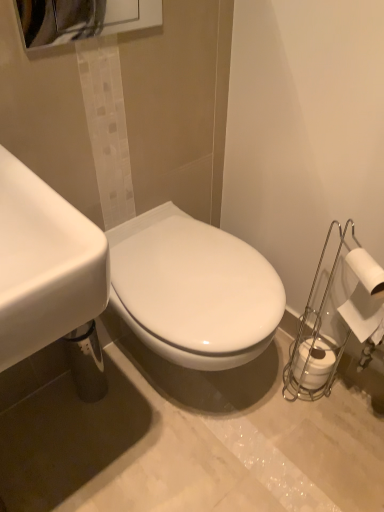
Question: Considering the relative positions of white matte toilet paper at lower right, placed as the 1th toilet paper when sorted from bottom to top, and white matte toilet paper at right, the 1th toilet paper positioned from the top, in the image provided, is white matte toilet paper at lower right, placed as the 1th toilet paper when sorted from bottom to top, to the right of white matte toilet paper at right, the 1th toilet paper positioned from the top, from the viewer's perspective?

Choices:
 (A) yes
 (B) no

Answer: (B)

Question: Is white matte toilet paper at lower right, placed as the 1th toilet paper when sorted from bottom to top, turned away from white matte toilet paper at right, the 1th toilet paper positioned from the top?

Choices:
 (A) yes
 (B) no

Answer: (B)

Question: From the image's perspective, would you say white matte toilet paper at lower right, which is the second toilet paper from front to back, is shown under white matte toilet paper at right, the 1th toilet paper positioned from the top?

Choices:
 (A) no
 (B) yes

Answer: (B)

Question: From a real-world perspective, does white matte toilet paper at lower right, which is the second toilet paper from front to back, stand above white matte toilet paper at right, the second toilet paper in the bottom-to-top sequence?

Choices:
 (A) no
 (B) yes

Answer: (A)

Question: Is white matte toilet paper at right, the 2th toilet paper positioned from the back, completely or partially inside white matte toilet paper at lower right, which is the second toilet paper from front to back?

Choices:
 (A) yes
 (B) no

Answer: (B)

Question: Does white matte toilet paper at lower right, marked as the first toilet paper in a back-to-front arrangement, have a greater height compared to white matte toilet paper at right, the second toilet paper in the bottom-to-top sequence?

Choices:
 (A) yes
 (B) no

Answer: (B)

Question: Is white matte toilet paper at lower right, which is the second toilet paper from front to back, smaller than white glossy sink at left?

Choices:
 (A) no
 (B) yes

Answer: (B)

Question: Considering the relative sizes of white matte toilet paper at lower right, placed as the 1th toilet paper when sorted from bottom to top, and white glossy sink at left in the image provided, is white matte toilet paper at lower right, placed as the 1th toilet paper when sorted from bottom to top, shorter than white glossy sink at left?

Choices:
 (A) no
 (B) yes

Answer: (B)

Question: Can you confirm if white matte toilet paper at lower right, marked as the first toilet paper in a back-to-front arrangement, is positioned to the right of white glossy sink at left?

Choices:
 (A) no
 (B) yes

Answer: (B)

Question: From a real-world perspective, is white matte toilet paper at lower right, marked as the first toilet paper in a back-to-front arrangement, positioned over white glossy sink at left based on gravity?

Choices:
 (A) no
 (B) yes

Answer: (A)

Question: Does white matte toilet paper at lower right, arranged as the second toilet paper when viewed from the top, come behind white glossy sink at left?

Choices:
 (A) no
 (B) yes

Answer: (B)

Question: From the image's perspective, would you say white matte toilet paper at lower right, placed as the 1th toilet paper when sorted from bottom to top, is positioned over white glossy sink at left?

Choices:
 (A) yes
 (B) no

Answer: (B)

Question: Is white matte toilet paper at right, the 1th toilet paper positioned from the top, thinner than white matte toilet paper at lower right, which is the second toilet paper from front to back?

Choices:
 (A) no
 (B) yes

Answer: (B)